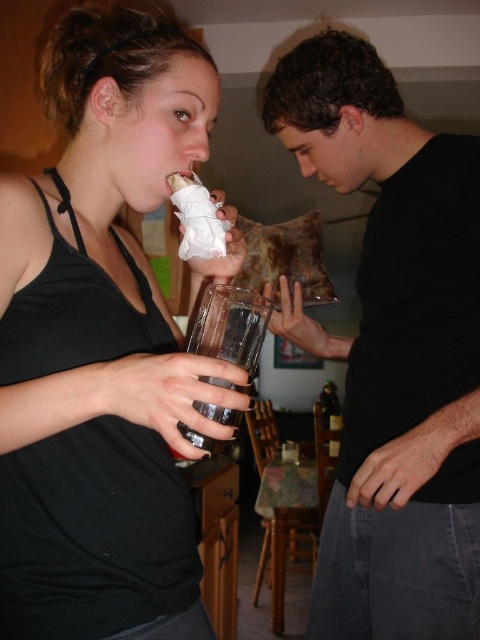
Can you confirm if matte black tank top at center is bigger than black matte shirt at center?

No, matte black tank top at center is not bigger than black matte shirt at center.

Does matte black tank top at center have a smaller size compared to black matte shirt at center?

Yes.

The width and height of the screenshot is (480, 640). What are the coordinates of `matte black tank top at center` in the screenshot? It's located at (101, 346).

Between point (48, 547) and point (233, 410), which one is positioned behind?

The point (48, 547) is behind.

Find the location of a particular element. Image resolution: width=480 pixels, height=640 pixels. matte black tank top at center is located at coordinates (101, 346).

Between point (324, 120) and point (261, 310), which one is positioned in front?

Point (261, 310) is in front.

Can you confirm if black matte shirt at center is thinner than transparent glass at center?

In fact, black matte shirt at center might be wider than transparent glass at center.

Image resolution: width=480 pixels, height=640 pixels. In order to click on black matte shirt at center in this screenshot , I will do `click(393, 352)`.